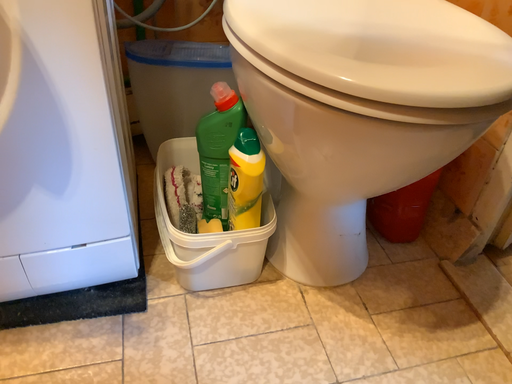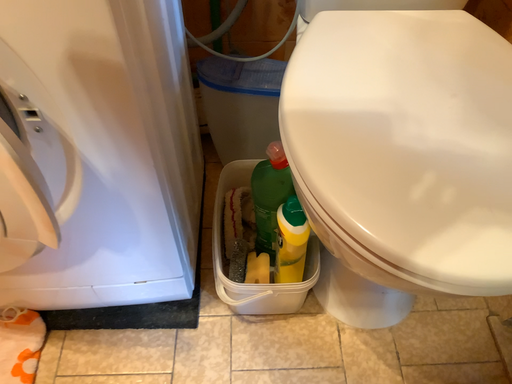
Question: How did the camera likely rotate when shooting the video?

Choices:
 (A) rotated upward
 (B) rotated downward

Answer: (B)